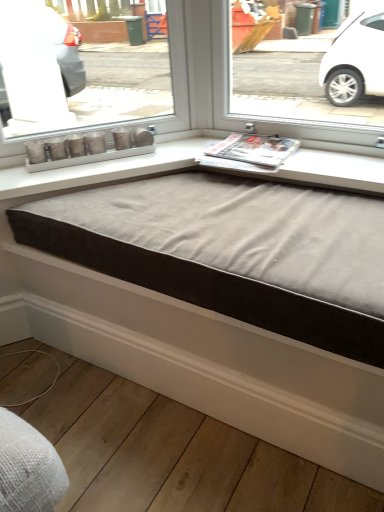
Question: Does white wood baseboard at lower center appear on the left side of suede-like fabric bed frame at center?

Choices:
 (A) no
 (B) yes

Answer: (B)

Question: Is white wood baseboard at lower center far from suede-like fabric bed frame at center?

Choices:
 (A) yes
 (B) no

Answer: (B)

Question: Is white wood baseboard at lower center positioned with its back to suede-like fabric bed frame at center?

Choices:
 (A) no
 (B) yes

Answer: (A)

Question: Does white wood baseboard at lower center have a lesser height compared to suede-like fabric bed frame at center?

Choices:
 (A) no
 (B) yes

Answer: (B)

Question: Is white wood baseboard at lower center not inside suede-like fabric bed frame at center?

Choices:
 (A) yes
 (B) no

Answer: (A)

Question: Relative to matte silver candlesticks at center, is white wood baseboard at lower center in front or behind?

Choices:
 (A) front
 (B) behind

Answer: (A)

Question: From the image's perspective, is white wood baseboard at lower center located above or below matte silver candlesticks at center?

Choices:
 (A) above
 (B) below

Answer: (B)

Question: Is white wood baseboard at lower center bigger or smaller than matte silver candlesticks at center?

Choices:
 (A) small
 (B) big

Answer: (B)

Question: In terms of height, does white wood baseboard at lower center look taller or shorter compared to matte silver candlesticks at center?

Choices:
 (A) short
 (B) tall

Answer: (A)

Question: Based on their sizes in the image, would you say suede-like fabric bed frame at center is bigger or smaller than matte silver candlesticks at center?

Choices:
 (A) small
 (B) big

Answer: (B)

Question: Is point (301, 285) closer or farther from the camera than point (89, 159)?

Choices:
 (A) farther
 (B) closer

Answer: (B)

Question: From a real-world perspective, is suede-like fabric bed frame at center above or below matte silver candlesticks at center?

Choices:
 (A) above
 (B) below

Answer: (B)

Question: Looking at their shapes, would you say suede-like fabric bed frame at center is wider or thinner than matte silver candlesticks at center?

Choices:
 (A) thin
 (B) wide

Answer: (B)

Question: Considering the positions of white wood baseboard at lower center and suede-like fabric bed frame at center in the image, is white wood baseboard at lower center taller or shorter than suede-like fabric bed frame at center?

Choices:
 (A) short
 (B) tall

Answer: (A)

Question: Relative to suede-like fabric bed frame at center, is white wood baseboard at lower center in front or behind?

Choices:
 (A) behind
 (B) front

Answer: (A)